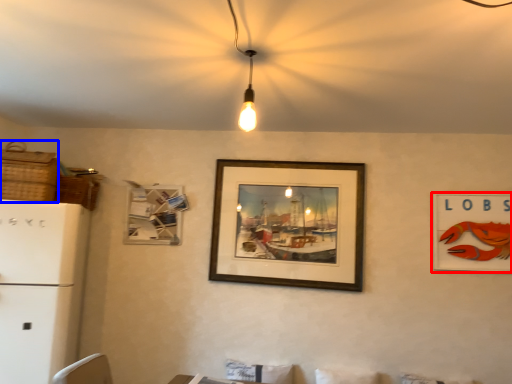
Question: Which object is further to the camera taking this photo, picture frame (highlighted by a red box) or basket (highlighted by a blue box)?

Choices:
 (A) picture frame
 (B) basket

Answer: (A)